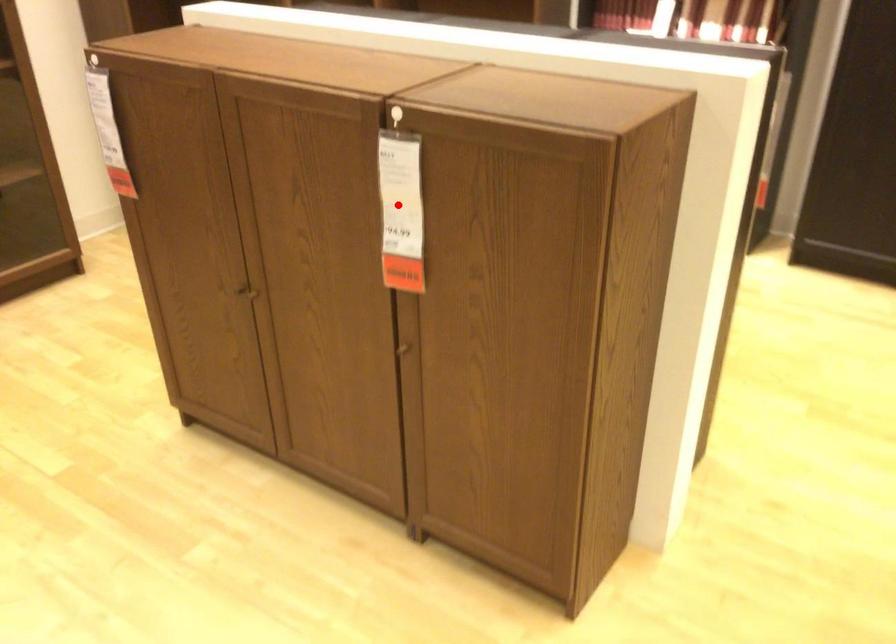
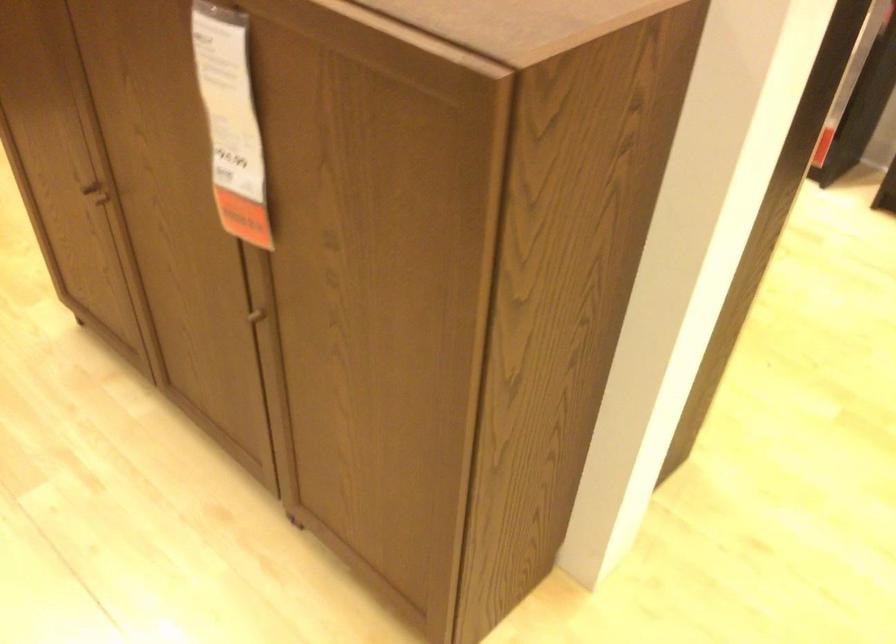
Question: I am providing you with two images of the same scene from different viewpoints. Given a red point in image1, look at the same physical point in image2. Is it:

Choices:
 (A) Closer to the viewpoint
 (B) Farther from the viewpoint

Answer: (A)